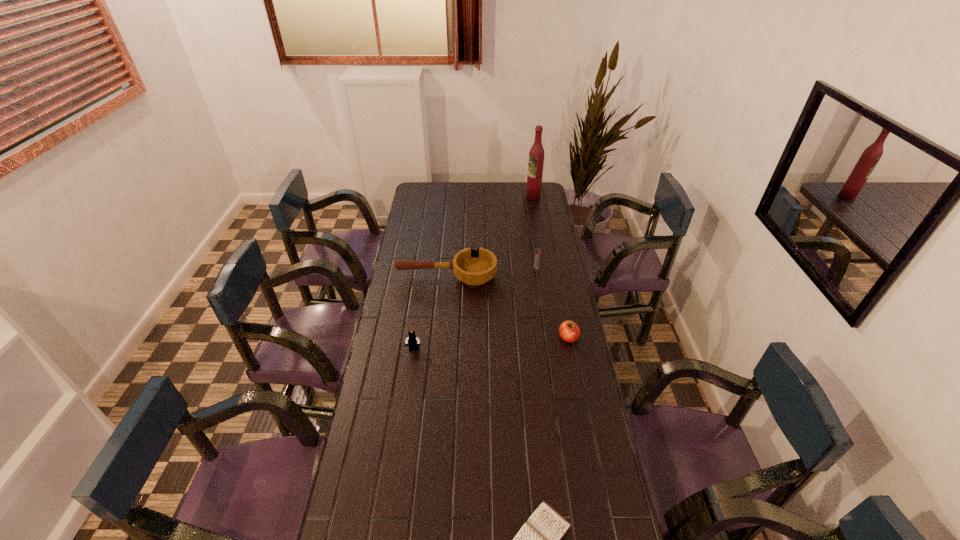
I want to click on vacant position at the left edge of the desktop, so click(389, 339).

In the image, there is a desktop. Where is `free space at the right edge`? free space at the right edge is located at coordinates (541, 206).

Where is `free space at the far left corner of the desktop`? free space at the far left corner of the desktop is located at coordinates (413, 199).

Where is `free space between the farthest object and the third nearest object`? free space between the farthest object and the third nearest object is located at coordinates (551, 267).

Identify the location of empty space between the saucepan and the tallest object. (490, 236).

Image resolution: width=960 pixels, height=540 pixels. I want to click on empty space between the igniter and the fifth farthest object, so click(x=475, y=309).

Where is `vacant region between the fourth farthest object and the Lego`? This screenshot has width=960, height=540. vacant region between the fourth farthest object and the Lego is located at coordinates (491, 344).

What are the coordinates of `free spot between the third nearest object and the tallest object` in the screenshot? It's located at (551, 267).

Locate an element on the screen. vacant area between the igniter and the fourth farthest object is located at coordinates (552, 303).

Point out which object is positioned as the nearest to the igniter. Please provide its 2D coordinates. Your answer should be formatted as a tuple, i.e. [(x, y)], where the tuple contains the x and y coordinates of a point satisfying the conditions above.

[(474, 267)]